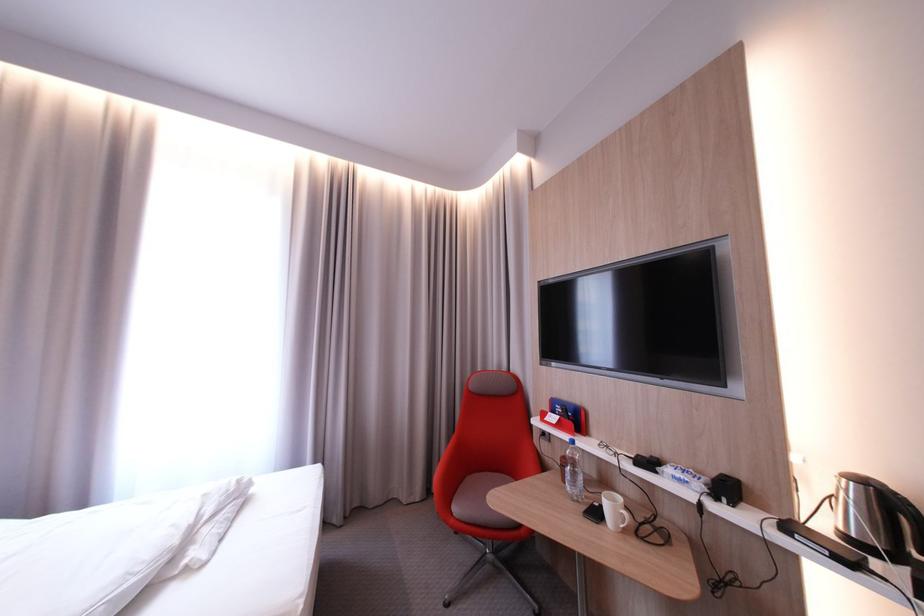
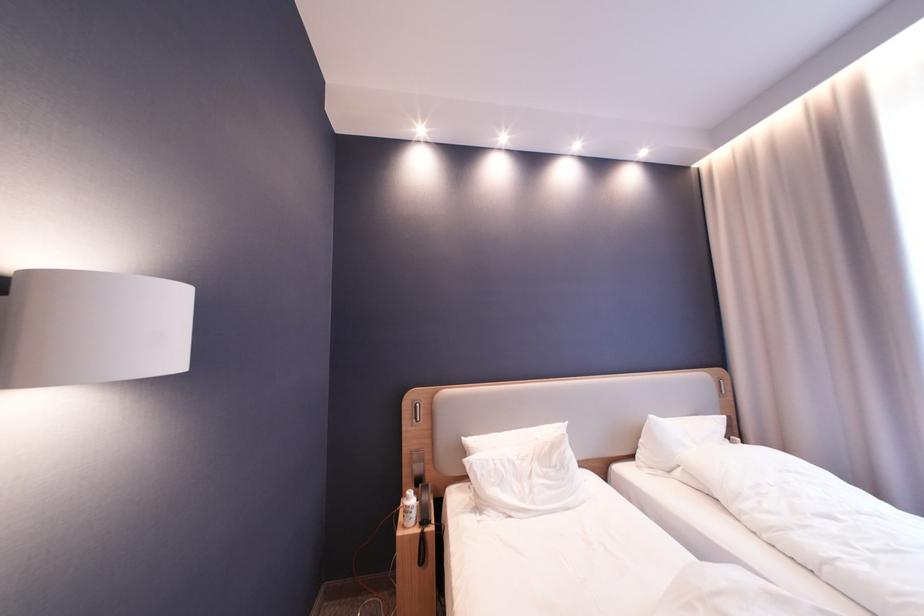
Question: Based on the continuous images, in which direction is the camera rotating? Reply with the corresponding letter.

Choices:
 (A) Left
 (B) Right
 (C) Up
 (D) Down

Answer: (A)